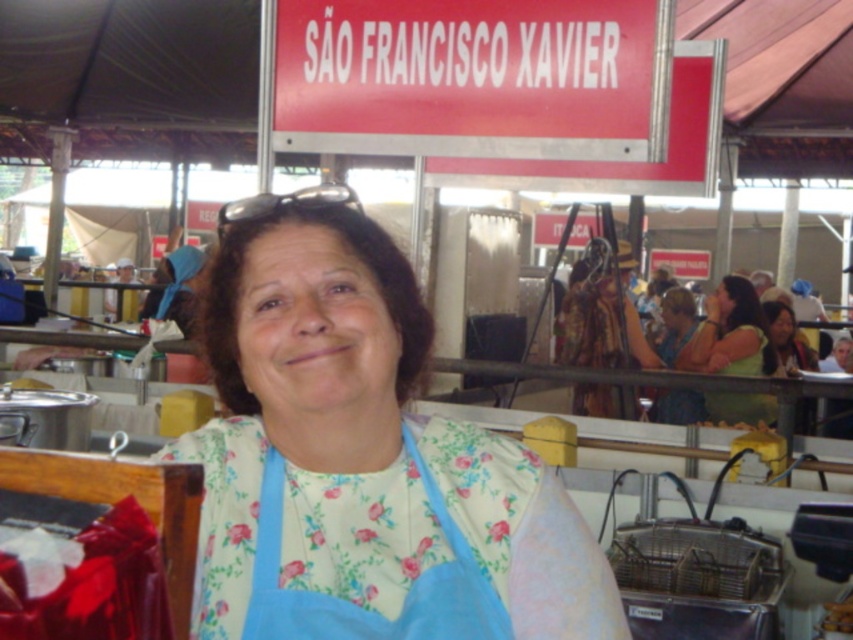
Does floral fabric apron at center appear over red plastic sign at upper center?

No.

Can you confirm if floral fabric apron at center is bigger than red plastic sign at upper center?

Actually, floral fabric apron at center might be smaller than red plastic sign at upper center.

You are a GUI agent. You are given a task and a screenshot of the screen. Output one action in this format:
    pyautogui.click(x=<x>, y=<y>)
    Task: Click on the floral fabric apron at center
    This screenshot has height=640, width=853.
    Given the screenshot: What is the action you would take?
    pyautogui.click(x=363, y=458)

Can you confirm if red plastic sign at upper center is thinner than green fabric shirt at right?

In fact, red plastic sign at upper center might be wider than green fabric shirt at right.

The image size is (853, 640). What are the coordinates of `red plastic sign at upper center` in the screenshot? It's located at (473, 77).

Can you confirm if red plastic sign at upper center is wider than blue floral fabric apron at center?

Indeed, red plastic sign at upper center has a greater width compared to blue floral fabric apron at center.

Is point (393, 33) behind point (282, 472)?

Yes.

Which is in front, point (572, 67) or point (386, 630)?

Point (386, 630) is more forward.

Where is `red plastic sign at upper center`? Image resolution: width=853 pixels, height=640 pixels. red plastic sign at upper center is located at coordinates (473, 77).